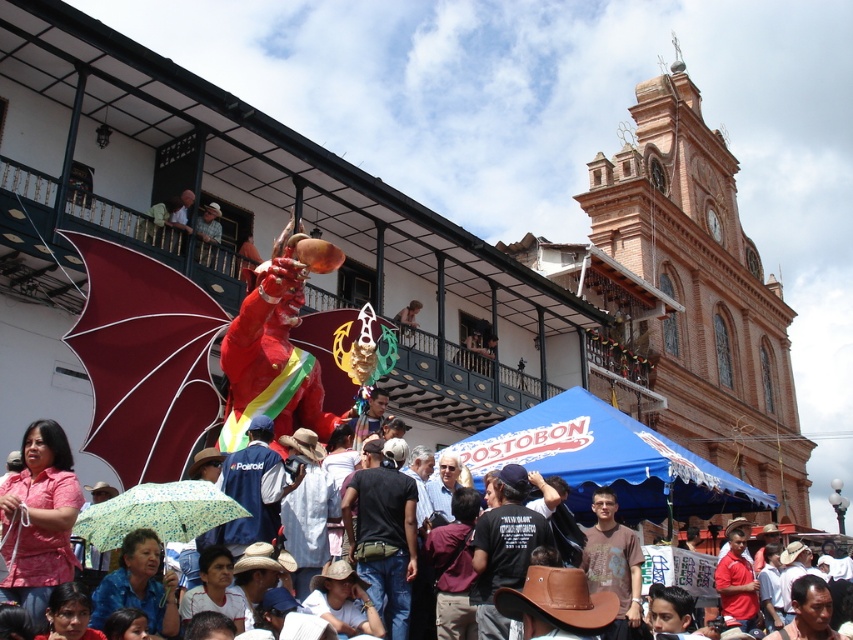
Does point (518, 438) come behind point (59, 452)?

Yes.

At what (x,y) coordinates should I click in order to perform the action: click on matte black cowboy hat at center. Please return your answer as a coordinate pair (x, y). The image size is (853, 640). Looking at the image, I should click on (608, 461).

Between point (622, 442) and point (33, 476), which one is positioned in front?

Point (33, 476) is more forward.

At what (x,y) coordinates should I click in order to perform the action: click on matte black cowboy hat at center. Please return your answer as a coordinate pair (x, y). The width and height of the screenshot is (853, 640). Looking at the image, I should click on (608, 461).

Between point (183, 314) and point (106, 541), which one is positioned in front?

Point (106, 541)

Identify the location of burgundy fabric umbrella at left. This screenshot has width=853, height=640. (144, 360).

Is point (102, 444) farther from viewer compared to point (218, 496)?

Yes, it is.

Locate an element on the screen. The width and height of the screenshot is (853, 640). burgundy fabric umbrella at left is located at coordinates (144, 360).

Does burgundy fabric umbrella at left have a lesser height compared to pink fabric at center?

Incorrect, burgundy fabric umbrella at left's height does not fall short of pink fabric at center's.

Is burgundy fabric umbrella at left smaller than pink fabric at center?

Actually, burgundy fabric umbrella at left might be larger than pink fabric at center.

Between point (181, 369) and point (68, 492), which one is positioned behind?

The point (181, 369) is more distant.

Identify the location of burgundy fabric umbrella at left. This screenshot has height=640, width=853. (144, 360).